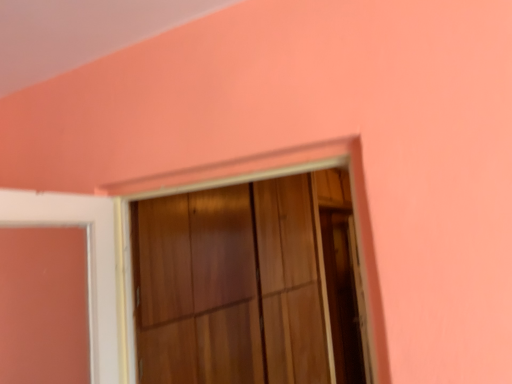
What are the coordinates of `transparent glass screen door at right` in the screenshot? It's located at (342, 298).

What do you see at coordinates (342, 298) in the screenshot? The width and height of the screenshot is (512, 384). I see `transparent glass screen door at right` at bounding box center [342, 298].

Consider the image. Measure the distance between point (343, 309) and camera.

A distance of 4.09 meters exists between point (343, 309) and camera.

At what (x,y) coordinates should I click in order to perform the action: click on wooden frame at center. Please return your answer as a coordinate pair (x, y). Looking at the image, I should click on (279, 176).

What do you see at coordinates (279, 176) in the screenshot?
I see `wooden frame at center` at bounding box center [279, 176].

Image resolution: width=512 pixels, height=384 pixels. Identify the location of transparent glass screen door at right. (342, 298).

Can you confirm if wooden frame at center is positioned to the right of transparent glass screen door at right?

No, wooden frame at center is not to the right of transparent glass screen door at right.

Considering the relative positions of wooden frame at center and transparent glass screen door at right in the image provided, is wooden frame at center in front of transparent glass screen door at right?

Yes, it is in front of transparent glass screen door at right.

Does point (136, 186) come closer to viewer compared to point (342, 265)?

That is True.

From the image's perspective, is wooden frame at center positioned above or below transparent glass screen door at right?

wooden frame at center is situated higher than transparent glass screen door at right in the image.

From a real-world perspective, which is physically above, wooden frame at center or transparent glass screen door at right?

wooden frame at center, from a real-world perspective.

Is wooden frame at center thinner than transparent glass screen door at right?

Incorrect, the width of wooden frame at center is not less than that of transparent glass screen door at right.

Considering the relative sizes of wooden frame at center and transparent glass screen door at right in the image provided, is wooden frame at center shorter than transparent glass screen door at right?

Yes.

Considering the sizes of wooden frame at center and transparent glass screen door at right in the image, is wooden frame at center bigger or smaller than transparent glass screen door at right?

Clearly, wooden frame at center is larger in size than transparent glass screen door at right.

Could transparent glass screen door at right be considered to be inside wooden frame at center?

No, transparent glass screen door at right is not a part of wooden frame at center.

Is wooden frame at center far from transparent glass screen door at right?

wooden frame at center is far away from transparent glass screen door at right.

From the picture: Is wooden frame at center positioned with its back to transparent glass screen door at right?

No.

At what (x,y) coordinates should I click in order to perform the action: click on screen door behind the wooden frame at center. Please return your answer as a coordinate pair (x, y). The height and width of the screenshot is (384, 512). Looking at the image, I should click on (342, 298).

Between transparent glass screen door at right and wooden frame at center, which one appears on the left side from the viewer's perspective?

Positioned to the left is wooden frame at center.

Is transparent glass screen door at right further to the viewer compared to wooden frame at center?

Yes.

Is point (365, 382) behind point (191, 168)?

Yes, point (365, 382) is farther from viewer.

In the scene shown: From the image's perspective, is transparent glass screen door at right located above wooden frame at center?

No, from the image's perspective, transparent glass screen door at right is not above wooden frame at center.

Consider the image. From a real-world perspective, is transparent glass screen door at right physically above wooden frame at center?

Actually, transparent glass screen door at right is physically below wooden frame at center in the real world.

In the scene shown: Between transparent glass screen door at right and wooden frame at center, which one has larger width?

With larger width is wooden frame at center.

Who is taller, transparent glass screen door at right or wooden frame at center?

With more height is transparent glass screen door at right.

Does transparent glass screen door at right have a smaller size compared to wooden frame at center?

Indeed, transparent glass screen door at right has a smaller size compared to wooden frame at center.

Does transparent glass screen door at right contain wooden frame at center?

That's incorrect, wooden frame at center is not inside transparent glass screen door at right.

Is transparent glass screen door at right placed right next to wooden frame at center?

No, transparent glass screen door at right is not in contact with wooden frame at center.

Looking at this image, is transparent glass screen door at right facing away from wooden frame at center?

No, wooden frame at center is not at the back of transparent glass screen door at right.

You are a GUI agent. You are given a task and a screenshot of the screen. Output one action in this format:
    pyautogui.click(x=<x>, y=<y>)
    Task: Click on the window frame above the transparent glass screen door at right (from a real-world perspective)
    The width and height of the screenshot is (512, 384).
    Given the screenshot: What is the action you would take?
    pyautogui.click(x=279, y=176)

Where is `window frame that is in front of the transparent glass screen door at right`? This screenshot has height=384, width=512. window frame that is in front of the transparent glass screen door at right is located at coordinates (279, 176).

The image size is (512, 384). In order to click on screen door behind the wooden frame at center in this screenshot , I will do `click(342, 298)`.